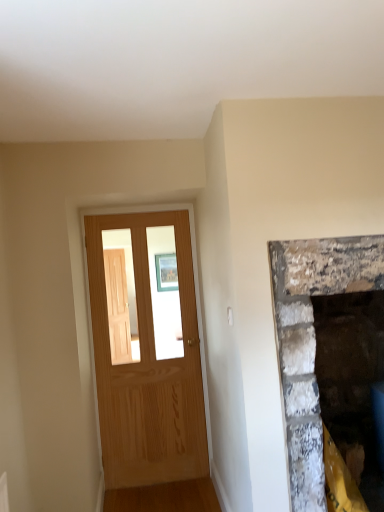
In order to click on rough stone fireplace at right in this screenshot , I will do `click(312, 342)`.

Image resolution: width=384 pixels, height=512 pixels. Describe the element at coordinates (312, 342) in the screenshot. I see `rough stone fireplace at right` at that location.

Describe the element at coordinates (148, 367) in the screenshot. I see `light brown wood door at left` at that location.

The width and height of the screenshot is (384, 512). Identify the location of light brown wood door at left. point(148,367).

What is the approximate height of light brown wood door at left?

The height of light brown wood door at left is 1.99 meters.

What are the coordinates of `rough stone fireplace at right` in the screenshot? It's located at (312, 342).

Which is more to the left, rough stone fireplace at right or light brown wood door at left?

light brown wood door at left.

Which is behind, rough stone fireplace at right or light brown wood door at left?

light brown wood door at left is behind.

Considering the points (335, 283) and (133, 441), which point is in front, point (335, 283) or point (133, 441)?

Point (335, 283)

From the image's perspective, between rough stone fireplace at right and light brown wood door at left, who is located below?

From the image's view, rough stone fireplace at right is below.

From a real-world perspective, relative to light brown wood door at left, is rough stone fireplace at right vertically above or below?

rough stone fireplace at right is situated lower than light brown wood door at left in the real world.

Which of these two, rough stone fireplace at right or light brown wood door at left, is wider?

rough stone fireplace at right is wider.

Who is taller, rough stone fireplace at right or light brown wood door at left?

light brown wood door at left.

Which of these two, rough stone fireplace at right or light brown wood door at left, is smaller?

With smaller size is light brown wood door at left.

Which is correct: rough stone fireplace at right is inside light brown wood door at left, or outside of it?

rough stone fireplace at right is spatially situated outside light brown wood door at left.

Based on the photo, is rough stone fireplace at right far from light brown wood door at left?

Absolutely, rough stone fireplace at right is distant from light brown wood door at left.

From the picture: Is rough stone fireplace at right positioned with its back to light brown wood door at left?

No, rough stone fireplace at right is not facing away from light brown wood door at left.

Can you tell me how much rough stone fireplace at right and light brown wood door at left differ in facing direction?

The facing directions of rough stone fireplace at right and light brown wood door at left are 2.87 degrees apart.

At what (x,y) coordinates should I click in order to perform the action: click on barn door above the rough stone fireplace at right (from the image's perspective). Please return your answer as a coordinate pair (x, y). Looking at the image, I should click on (148, 367).

Which object is positioned more to the right, light brown wood door at left or rough stone fireplace at right?

Positioned to the right is rough stone fireplace at right.

Is light brown wood door at left in front of or behind rough stone fireplace at right in the image?

In the image, light brown wood door at left appears behind rough stone fireplace at right.

Is point (171, 216) closer or farther from the camera than point (286, 285)?

Point (171, 216) appears to be farther away from the viewer than point (286, 285).

Consider the image. From the image's perspective, is light brown wood door at left over rough stone fireplace at right?

Yes, from the image's perspective, light brown wood door at left is over rough stone fireplace at right.

From a real-world perspective, which object stands above the other?

In real-world perspective, light brown wood door at left is above.

Can you confirm if light brown wood door at left is wider than rough stone fireplace at right?

No, light brown wood door at left is not wider than rough stone fireplace at right.

Does light brown wood door at left have a greater height compared to rough stone fireplace at right?

Correct, light brown wood door at left is much taller as rough stone fireplace at right.

Can you confirm if light brown wood door at left is bigger than rough stone fireplace at right?

Actually, light brown wood door at left might be smaller than rough stone fireplace at right.

Do you think light brown wood door at left is within rough stone fireplace at right, or outside of it?

light brown wood door at left lies outside rough stone fireplace at right.

Is light brown wood door at left beside rough stone fireplace at right?

No, light brown wood door at left is not making contact with rough stone fireplace at right.

Is rough stone fireplace at right at the back of light brown wood door at left?

No, rough stone fireplace at right is not at the back of light brown wood door at left.

Can you tell me how much light brown wood door at left and rough stone fireplace at right differ in facing direction?

The angle between the facing direction of light brown wood door at left and the facing direction of rough stone fireplace at right is 2.87 degrees.

How far apart are light brown wood door at left and rough stone fireplace at right?

A distance of 1.30 meters exists between light brown wood door at left and rough stone fireplace at right.

Identify the location of fireplace located below the light brown wood door at left (from the image's perspective). (312, 342).

In the image, there is a rough stone fireplace at right. At what (x,y) coordinates should I click in order to perform the action: click on barn door above it (from the image's perspective). Please return your answer as a coordinate pair (x, y). Image resolution: width=384 pixels, height=512 pixels. Looking at the image, I should click on (148, 367).

What are the coordinates of `fireplace that appears in front of the light brown wood door at left` in the screenshot? It's located at (312, 342).